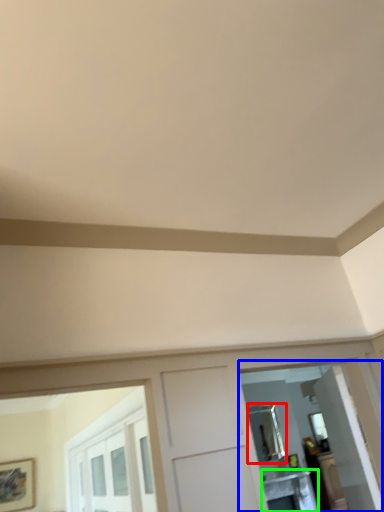
Question: Which object is positioned farthest from mirror (highlighted by a red box)? Select from mirror (highlighted by a blue box) and table (highlighted by a green box).

Choices:
 (A) mirror
 (B) table

Answer: (A)